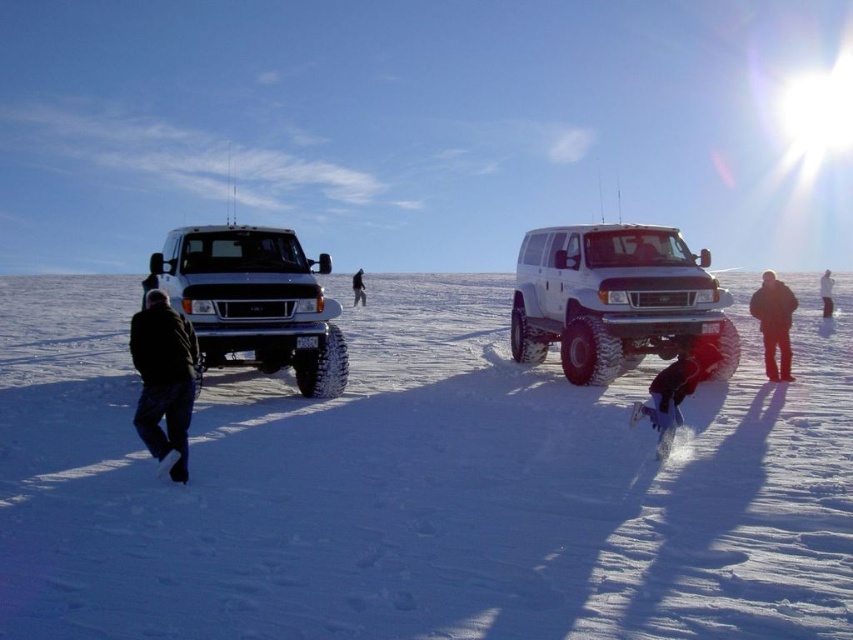
You are standing in the snowy landscape and want to take a photo of the white matte truck at left without the white powdery snow at center blocking the view. Is it possible to do so?

The white powdery snow at center is closer to the viewer than the white matte truck at left, so it may block the view. To take a photo without the snow blocking the truck, you would need to move your position so that the snow is no longer in front of the truck.

You are standing in the snowy landscape and want to walk towards the white matte truck at left. Which direction should you head relative to the white powdery snow at center?

The white powdery snow at center is to the right of the white matte truck at left, so to reach the truck, you should head to the left from the snow.